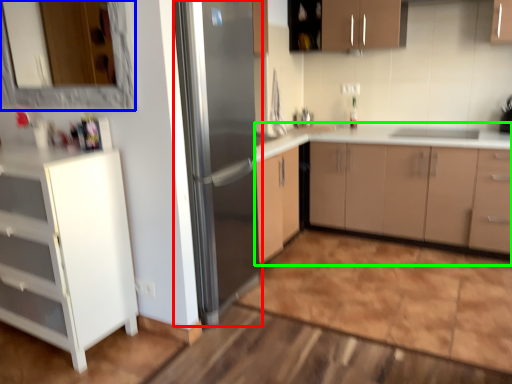
Question: Which object is positioned closest to refrigerator (highlighted by a red box)? Select from mirror (highlighted by a blue box) and cabinetry (highlighted by a green box).

Choices:
 (A) mirror
 (B) cabinetry

Answer: (B)